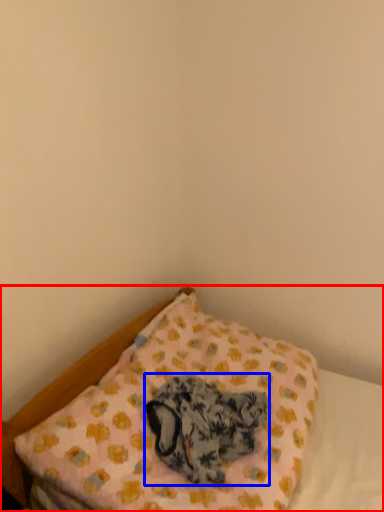
Question: Which object appears closest to the camera in this image, bed (highlighted by a red box) or animal (highlighted by a blue box)?

Choices:
 (A) bed
 (B) animal

Answer: (A)